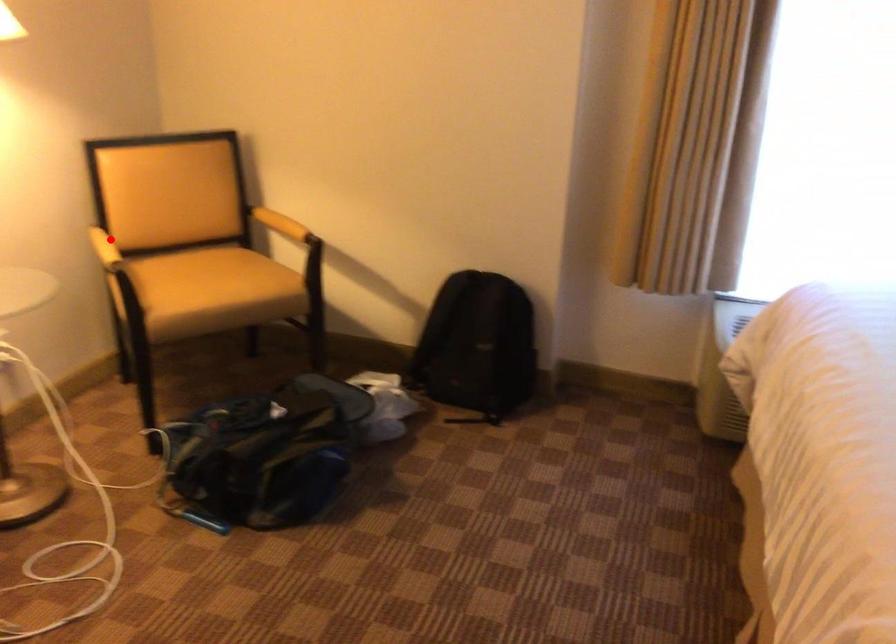
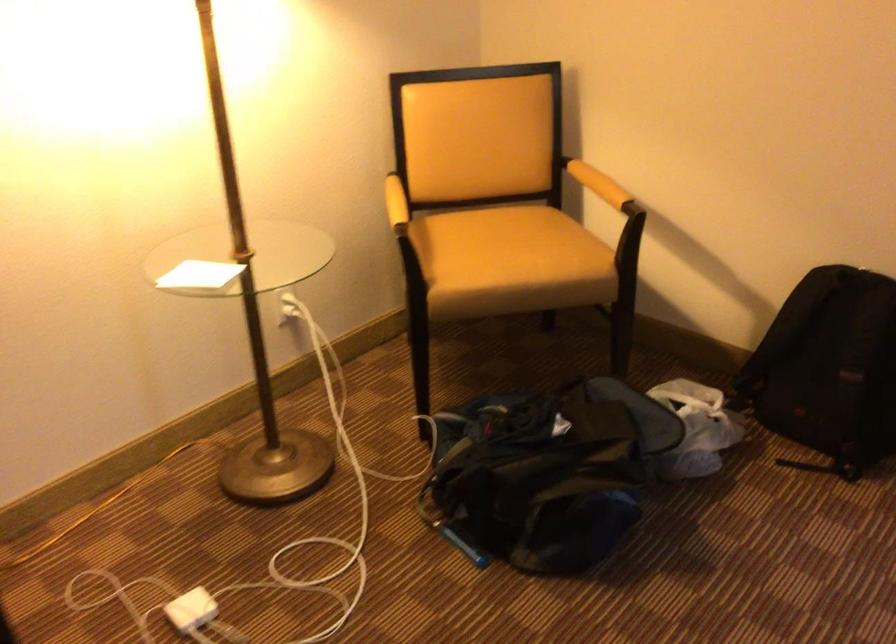
Question: I am providing you with two images of the same scene from different viewpoints. A red point is shown in image1. For the corresponding object point in image2, is it positioned nearer or farther from the camera?

Choices:
 (A) Nearer
 (B) Farther

Answer: (A)